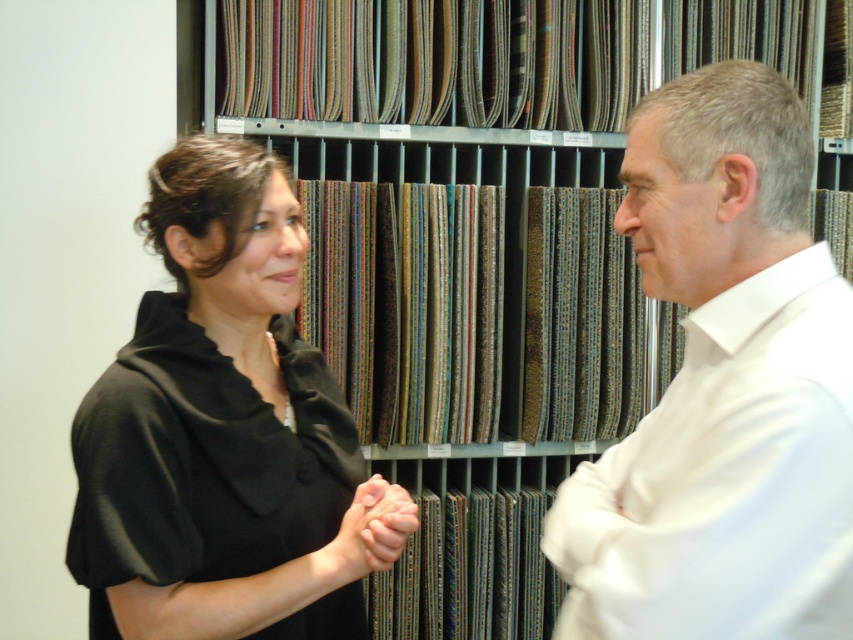
Who is positioned more to the left, black satin blouse at left or smooth skin hands at center?

From the viewer's perspective, black satin blouse at left appears more on the left side.

Between black satin blouse at left and smooth skin hands at center, which one is positioned higher?

black satin blouse at left

Describe the element at coordinates (215, 426) in the screenshot. Image resolution: width=853 pixels, height=640 pixels. I see `black satin blouse at left` at that location.

Identify the location of black satin blouse at left. (215, 426).

Who is more forward, (780, 212) or (218, 244)?

Point (780, 212)

Does white satin shirt at right come in front of black satin blouse at left?

Yes.

Is point (648, 566) positioned before point (321, 365)?

Yes, it is.

Locate an element on the screen. The height and width of the screenshot is (640, 853). white satin shirt at right is located at coordinates (723, 388).

Who is higher up, white satin shirt at right or smooth skin hands at center?

white satin shirt at right is higher up.

Does white satin shirt at right have a larger size compared to smooth skin hands at center?

Correct, white satin shirt at right is larger in size than smooth skin hands at center.

Is point (764, 179) more distant than point (386, 540)?

No, it is in front of (386, 540).

Identify the location of white satin shirt at right. The width and height of the screenshot is (853, 640). (723, 388).